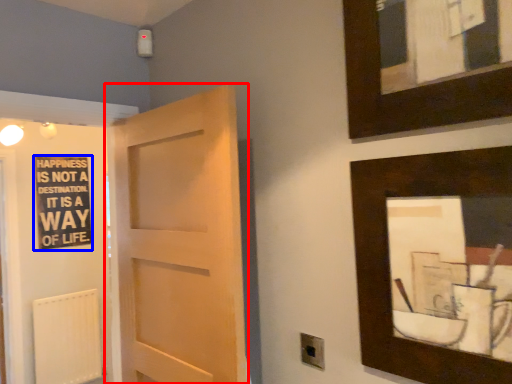
Question: Which object is closer to the camera taking this photo, door (highlighted by a red box) or bulletin board (highlighted by a blue box)?

Choices:
 (A) door
 (B) bulletin board

Answer: (A)